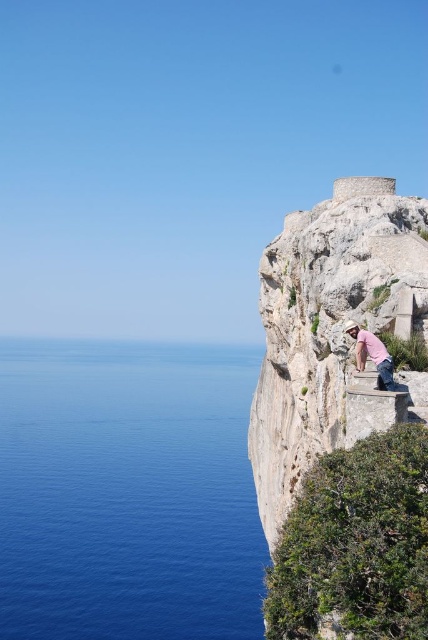
Consider the image. Can you confirm if blue water at left is shorter than rough stone cliff at right?

In fact, blue water at left may be taller than rough stone cliff at right.

Who is more forward, (243,368) or (415,228)?

Point (415,228)

This screenshot has width=428, height=640. Describe the element at coordinates (127, 492) in the screenshot. I see `blue water at left` at that location.

This screenshot has height=640, width=428. What are the coordinates of `blue water at left` in the screenshot? It's located at (127, 492).

Is rough stone cliff at right below pink cotton shirt at center?

Yes, rough stone cliff at right is below pink cotton shirt at center.

Does rough stone cliff at right have a lesser width compared to pink cotton shirt at center?

Incorrect, rough stone cliff at right's width is not less than pink cotton shirt at center's.

Does point (270, 417) come farther from viewer compared to point (360, 356)?

Yes, it is.

This screenshot has width=428, height=640. I want to click on rough stone cliff at right, so [x=335, y=332].

Can you confirm if blue water at left is positioned above pink cotton shirt at center?

No.

Between point (192, 628) and point (389, 365), which one is positioned in front?

Point (389, 365)

Between point (53, 492) and point (371, 342), which one is positioned in front?

Point (371, 342) is in front.

Locate an element on the screen. Image resolution: width=428 pixels, height=640 pixels. blue water at left is located at coordinates (127, 492).